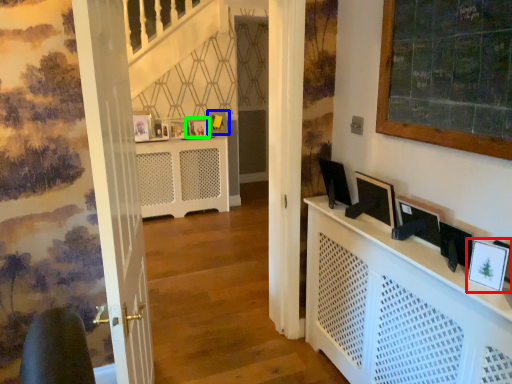
Question: Based on their relative distances, which object is nearer to picture frame (highlighted by a red box)? Choose from picture frame (highlighted by a blue box) and picture frame (highlighted by a green box).

Choices:
 (A) picture frame
 (B) picture frame

Answer: (B)